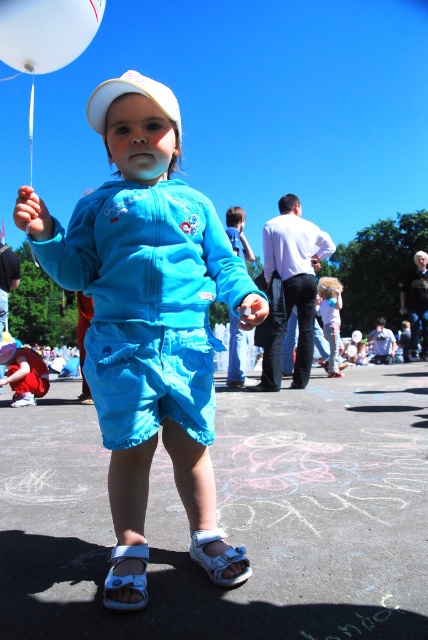
Question: Which object appears closest to the camera in this image?

Choices:
 (A) matte blue jumpsuit at center
 (B) blue fabric sandal at lower center

Answer: (A)

Question: Can you confirm if blue fabric sandal at lower center is bigger than light blue denim shorts at center?

Choices:
 (A) yes
 (B) no

Answer: (B)

Question: Can you confirm if matte blue jumpsuit at center is thinner than blue fabric sandal at lower center?

Choices:
 (A) yes
 (B) no

Answer: (B)

Question: Based on their relative distances, which object is farther from the smooth asphalt at center?

Choices:
 (A) white matte hat at center
 (B) light blue denim shorts at center
 (C) white glossy balloon at upper left
 (D) blue fabric sandal at lower center

Answer: (B)

Question: Is white glossy balloon at upper left in front of white fabric sandal at lower center?

Choices:
 (A) no
 (B) yes

Answer: (A)

Question: Among these points, which one is farthest from the camera?

Choices:
 (A) (332, 323)
 (B) (89, 104)

Answer: (A)